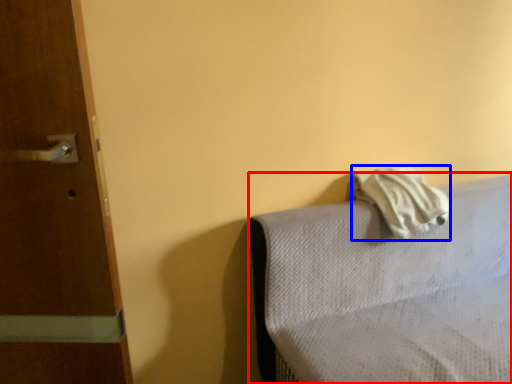
Question: Which point is closer to the camera, furniture (highlighted by a red box) or bath towel (highlighted by a blue box)?

Choices:
 (A) furniture
 (B) bath towel

Answer: (A)